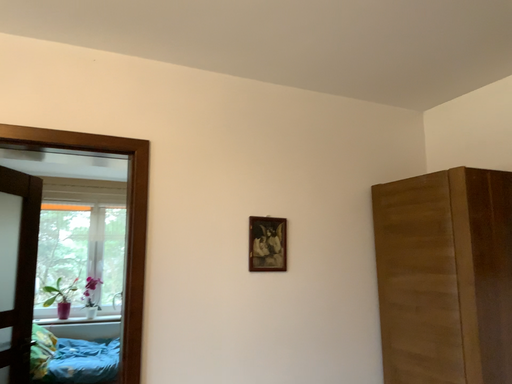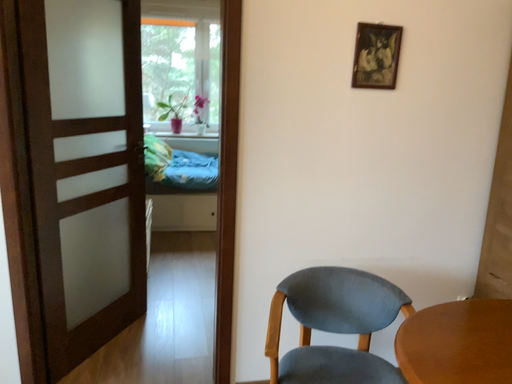
Question: Which way did the camera rotate in the video?

Choices:
 (A) rotated upward
 (B) rotated downward

Answer: (B)